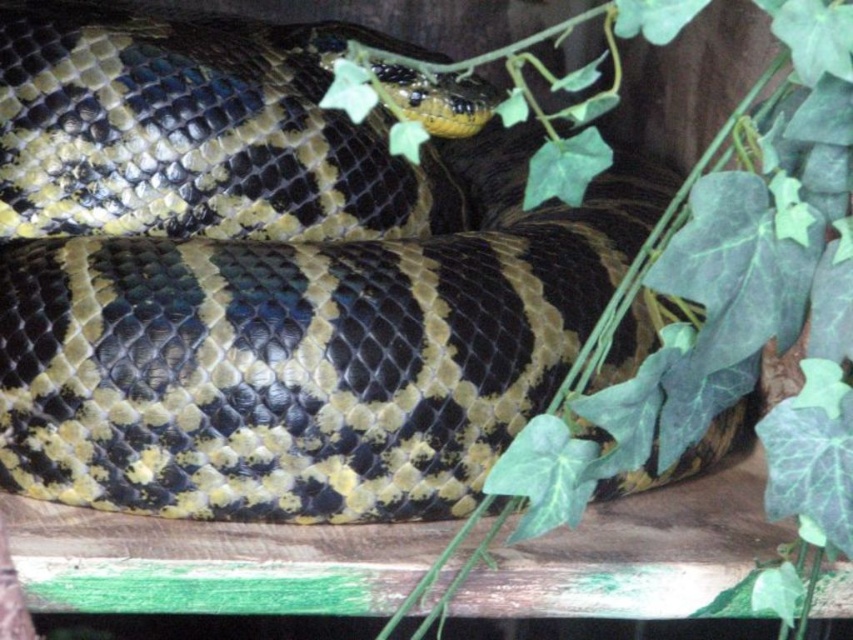
What do you see at coordinates (273, 272) in the screenshot? I see `yellow-green scales at center` at bounding box center [273, 272].

Which of these two, yellow-green scales at center or green leafy vine at upper center, stands taller?

Standing taller between the two is yellow-green scales at center.

Where is `yellow-green scales at center`? The image size is (853, 640). yellow-green scales at center is located at coordinates click(273, 272).